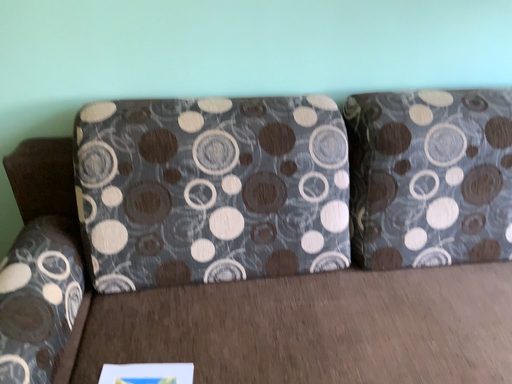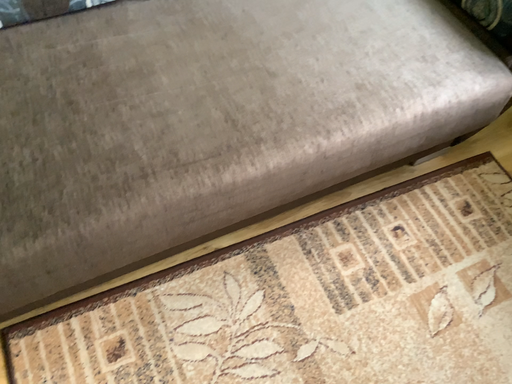
Question: How did the camera likely rotate when shooting the video?

Choices:
 (A) rotated downward
 (B) rotated upward

Answer: (A)